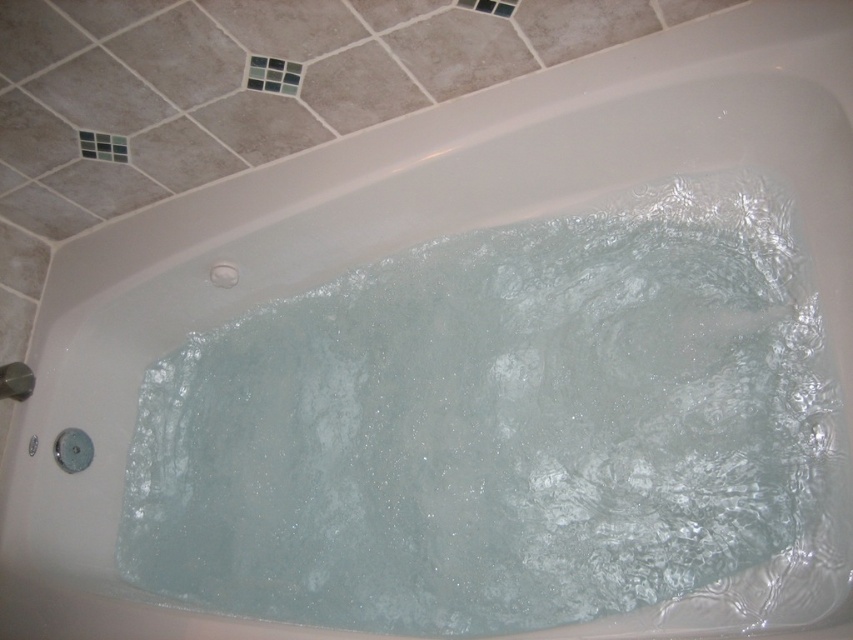
Question: Can you confirm if clear glass tile at upper center is bigger than brushed metal shower at lower left?

Choices:
 (A) no
 (B) yes

Answer: (B)

Question: Can you confirm if clear glass tile at upper center is positioned below brushed metal shower at lower left?

Choices:
 (A) yes
 (B) no

Answer: (B)

Question: Among these points, which one is nearest to the camera?

Choices:
 (A) (22, 374)
 (B) (276, 77)

Answer: (B)

Question: Where is clear glass tile at upper center located in relation to brushed metal shower at lower left in the image?

Choices:
 (A) right
 (B) left

Answer: (A)